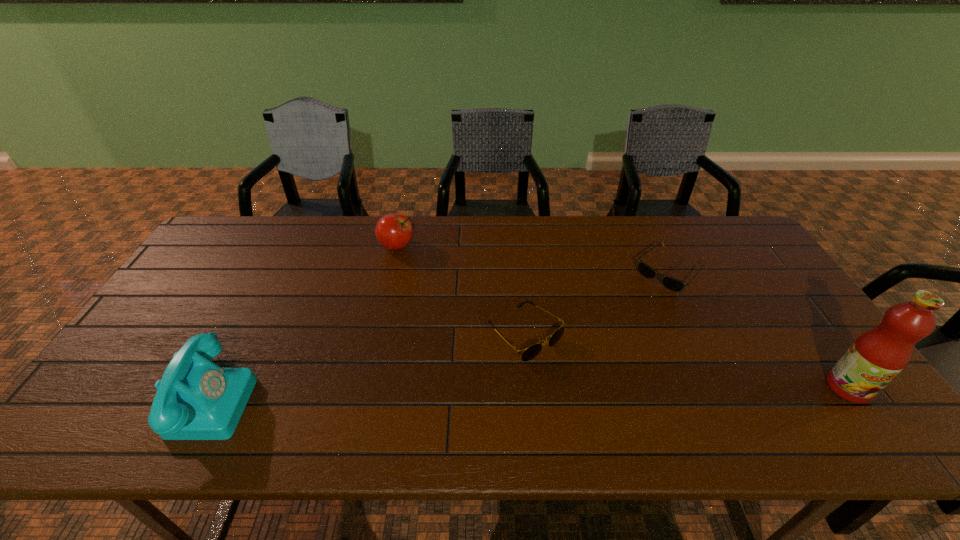
Locate an element on the screen. The image size is (960, 540). free space on the desktop that is between the fourth shortest object and the tallest object and is positioned on the front-facing side of the taller sunglasses is located at coordinates (587, 392).

The image size is (960, 540). I want to click on vacant spot on the desktop that is between the telephone and the rightmost object and is positioned on the stem of the third shortest object, so click(x=563, y=392).

Identify the location of free space on the desktop that is between the leftmost object and the tallest object and is positioned on the lenses of the farther sunglasses. The width and height of the screenshot is (960, 540). (546, 392).